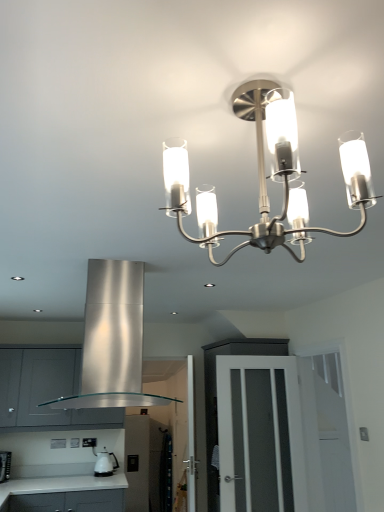
Locate an element on the screen. This screenshot has width=384, height=512. free point above satin nickel chandelier at upper center (from a real-world perspective) is located at coordinates (254, 75).